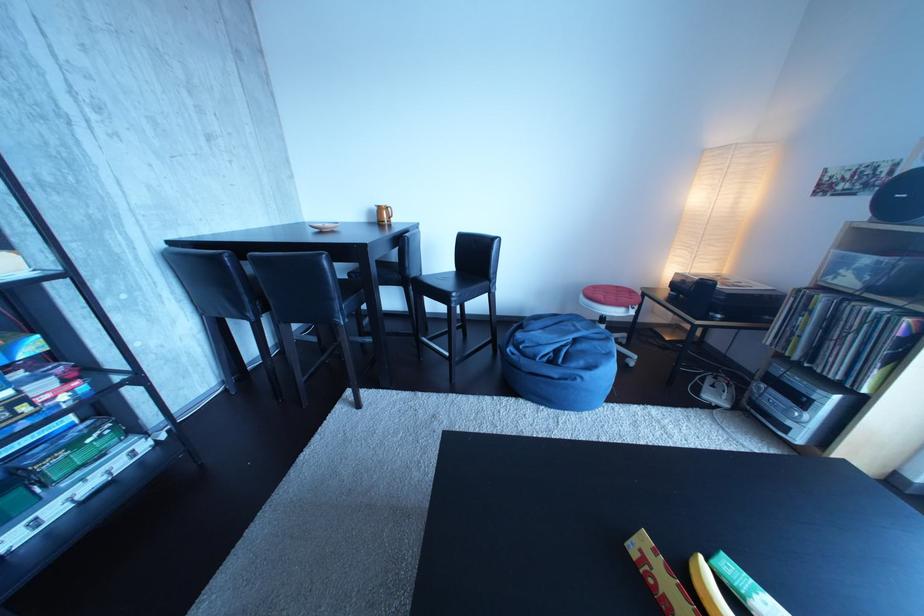
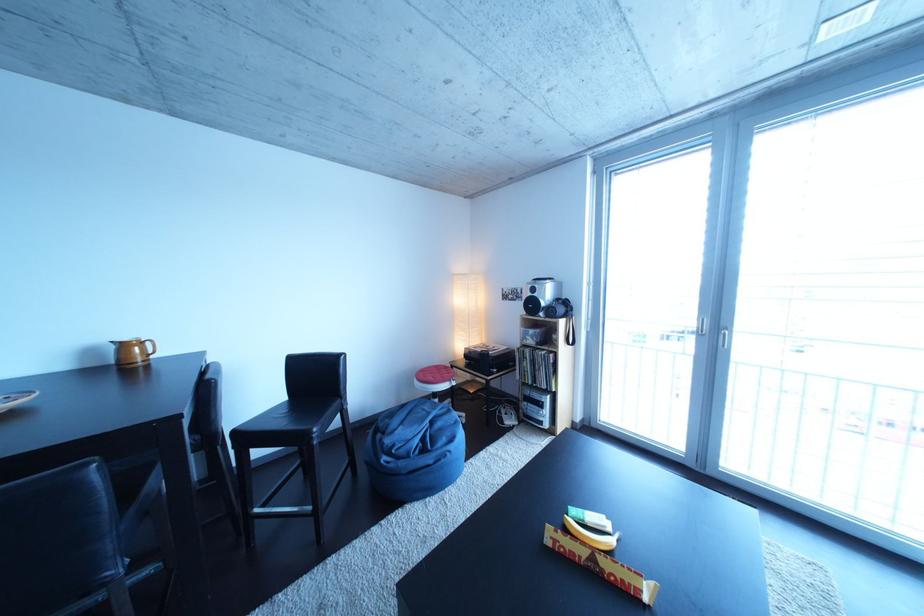
In the second image, find the point that corresponds to point (393, 215) in the first image.

(138, 351)